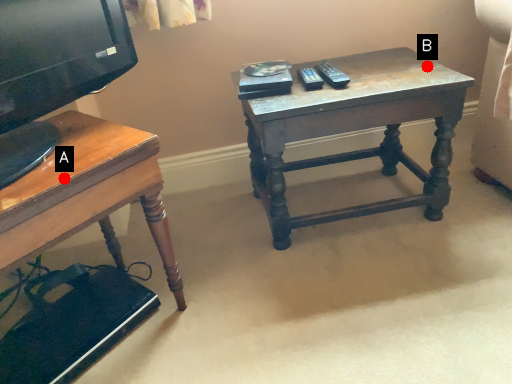
Question: Two points are circled on the image, labeled by A and B beside each circle. Which point is closer to the camera?

Choices:
 (A) A is closer
 (B) B is closer

Answer: (A)